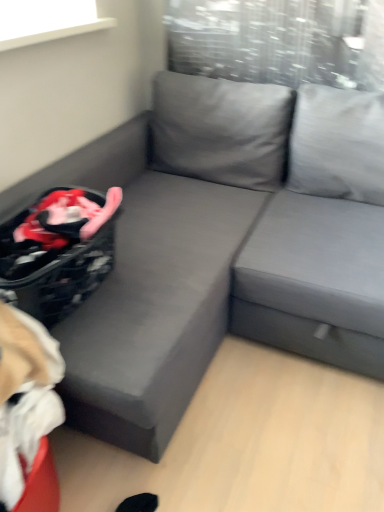
This screenshot has height=512, width=384. What do you see at coordinates (28, 411) in the screenshot?
I see `beige fabric bean bag chair at lower left` at bounding box center [28, 411].

I want to click on gray fabric couch at center, so click(314, 281).

The height and width of the screenshot is (512, 384). What do you see at coordinates (314, 281) in the screenshot? I see `gray fabric couch at center` at bounding box center [314, 281].

I want to click on beige fabric bean bag chair at lower left, so click(28, 411).

Can you confirm if gray fabric couch at center is thinner than black textured laundry basket at lower left?

In fact, gray fabric couch at center might be wider than black textured laundry basket at lower left.

From the image's perspective, which one is positioned lower, gray fabric couch at center or black textured laundry basket at lower left?

black textured laundry basket at lower left.

Would you say gray fabric couch at center contains black textured laundry basket at lower left?

That's incorrect, black textured laundry basket at lower left is not inside gray fabric couch at center.

Who is more distant, gray fabric couch at center or beige fabric bean bag chair at lower left?

gray fabric couch at center is behind.

Looking at this image, does gray fabric couch at center turn towards beige fabric bean bag chair at lower left?

No.

Is gray fabric couch at center outside of beige fabric bean bag chair at lower left?

Indeed, gray fabric couch at center is completely outside beige fabric bean bag chair at lower left.

Is gray fabric couch at center bigger than beige fabric bean bag chair at lower left?

Indeed, gray fabric couch at center has a larger size compared to beige fabric bean bag chair at lower left.

Does black textured laundry basket at lower left have a larger size compared to beige fabric bean bag chair at lower left?

Actually, black textured laundry basket at lower left might be smaller than beige fabric bean bag chair at lower left.

Is black textured laundry basket at lower left oriented towards beige fabric bean bag chair at lower left?

No.

Is black textured laundry basket at lower left positioned in front of beige fabric bean bag chair at lower left?

No, it is not.

Is black textured laundry basket at lower left far from beige fabric bean bag chair at lower left?

black textured laundry basket at lower left is near beige fabric bean bag chair at lower left, not far away.

From the image's perspective, is beige fabric bean bag chair at lower left located above or below black textured laundry basket at lower left?

beige fabric bean bag chair at lower left is situated lower than black textured laundry basket at lower left in the image.

Is beige fabric bean bag chair at lower left to the left or to the right of black textured laundry basket at lower left in the image?

beige fabric bean bag chair at lower left is to the left of black textured laundry basket at lower left.

Where is `bean bag chair that is in front of the black textured laundry basket at lower left`? The image size is (384, 512). bean bag chair that is in front of the black textured laundry basket at lower left is located at coordinates (28, 411).

Is beige fabric bean bag chair at lower left wider or thinner than black textured laundry basket at lower left?

beige fabric bean bag chair at lower left is wider than black textured laundry basket at lower left.

Which of these two, beige fabric bean bag chair at lower left or gray fabric couch at center, stands shorter?

Standing shorter between the two is beige fabric bean bag chair at lower left.

Which object is positioned more to the right, beige fabric bean bag chair at lower left or gray fabric couch at center?

gray fabric couch at center is more to the right.

Considering the sizes of objects beige fabric bean bag chair at lower left and gray fabric couch at center in the image provided, who is bigger, beige fabric bean bag chair at lower left or gray fabric couch at center?

gray fabric couch at center is bigger.

The image size is (384, 512). Find the location of `laundry basket in front of the gray fabric couch at center`. laundry basket in front of the gray fabric couch at center is located at coordinates (57, 251).

Is black textured laundry basket at lower left facing away from gray fabric couch at center?

No, black textured laundry basket at lower left is not facing away from gray fabric couch at center.

How many degrees apart are the facing directions of black textured laundry basket at lower left and gray fabric couch at center?

There is a 86.1-degree angle between the facing directions of black textured laundry basket at lower left and gray fabric couch at center.

The image size is (384, 512). Identify the location of table above the black textured laundry basket at lower left (from the image's perspective). (314, 281).

This screenshot has height=512, width=384. Identify the location of bean bag chair below the gray fabric couch at center (from the image's perspective). (28, 411).

Which object lies nearer to the anchor point black textured laundry basket at lower left, beige fabric bean bag chair at lower left or gray fabric couch at center?

beige fabric bean bag chair at lower left.

When comparing their distances from beige fabric bean bag chair at lower left, does gray fabric couch at center or black textured laundry basket at lower left seem further?

Among the two, gray fabric couch at center is located further to beige fabric bean bag chair at lower left.

Consider the image. Estimate the real-world distances between objects in this image. Which object is further from gray fabric couch at center, beige fabric bean bag chair at lower left or black textured laundry basket at lower left?

Among the two, beige fabric bean bag chair at lower left is located further to gray fabric couch at center.

Based on their spatial positions, is gray fabric couch at center or beige fabric bean bag chair at lower left closer to black textured laundry basket at lower left?

Among the two, beige fabric bean bag chair at lower left is located nearer to black textured laundry basket at lower left.

Estimate the real-world distances between objects in this image. Which object is further from beige fabric bean bag chair at lower left, black textured laundry basket at lower left or gray fabric couch at center?

gray fabric couch at center is further to beige fabric bean bag chair at lower left.

Looking at the image, which one is located closer to gray fabric couch at center, black textured laundry basket at lower left or beige fabric bean bag chair at lower left?

Among the two, black textured laundry basket at lower left is located nearer to gray fabric couch at center.

Find the location of a particular element. This screenshot has width=384, height=512. laundry basket situated between beige fabric bean bag chair at lower left and gray fabric couch at center from left to right is located at coordinates (57, 251).